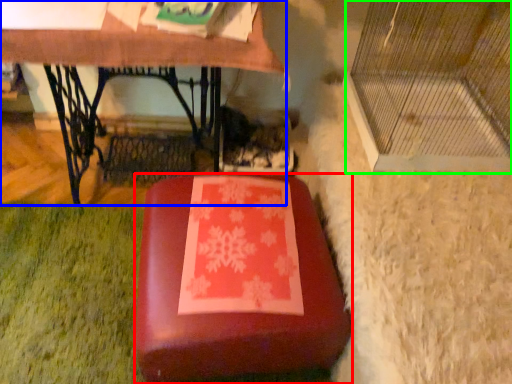
Question: Which object is the closest to the furniture (highlighted by a red box)? Choose among these: table (highlighted by a blue box) or glass door (highlighted by a green box).

Choices:
 (A) table
 (B) glass door

Answer: (B)